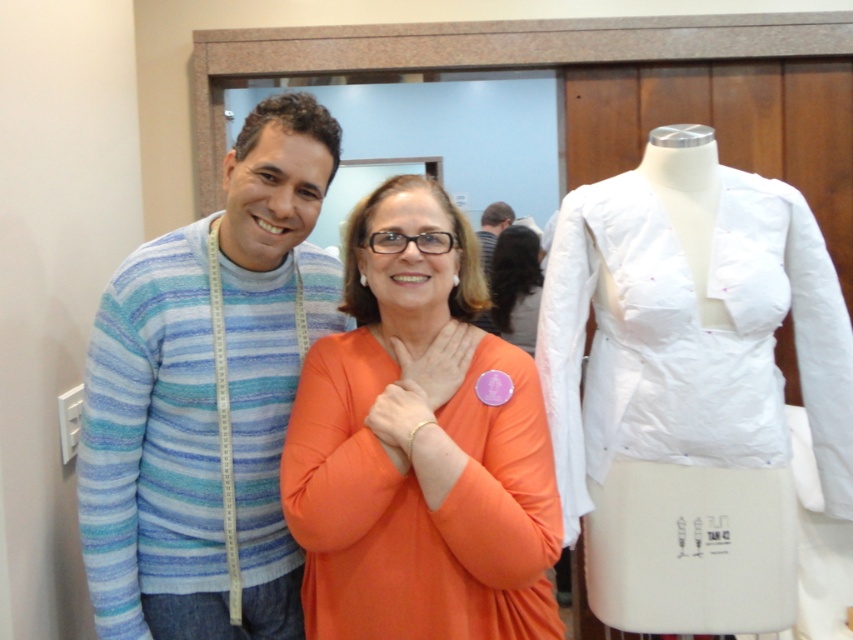
The height and width of the screenshot is (640, 853). What do you see at coordinates (515, 285) in the screenshot?
I see `orange fabric blouse at center` at bounding box center [515, 285].

Who is higher up, orange fabric blouse at center or striped fabric shirt at upper center?

striped fabric shirt at upper center is higher up.

Where is `orange fabric blouse at center`? orange fabric blouse at center is located at coordinates (515, 285).

This screenshot has height=640, width=853. I want to click on orange fabric blouse at center, so click(515, 285).

Is point (102, 611) closer to viewer compared to point (479, 456)?

No, (102, 611) is further to viewer.

Is striped cotton sweater at center in front of orange matte shirt at center?

That is False.

Locate an element on the screen. This screenshot has width=853, height=640. striped cotton sweater at center is located at coordinates (207, 397).

Can you confirm if orange matte shirt at center is positioned to the right of striped fabric shirt at upper center?

Incorrect, orange matte shirt at center is not on the right side of striped fabric shirt at upper center.

Who is positioned more to the left, orange matte shirt at center or striped fabric shirt at upper center?

Positioned to the left is orange matte shirt at center.

This screenshot has height=640, width=853. I want to click on orange matte shirt at center, so click(419, 444).